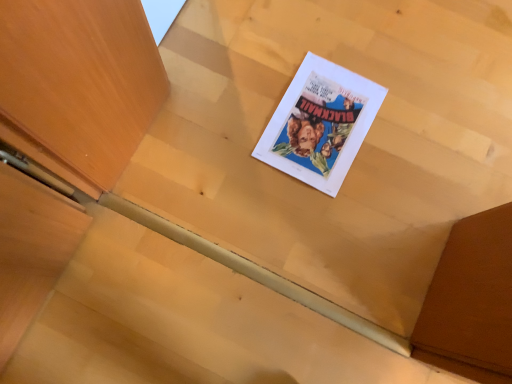
This screenshot has height=384, width=512. What are the coordinates of `free spot above white paper poster at center (from a real-world perspective)` in the screenshot? It's located at point(321,121).